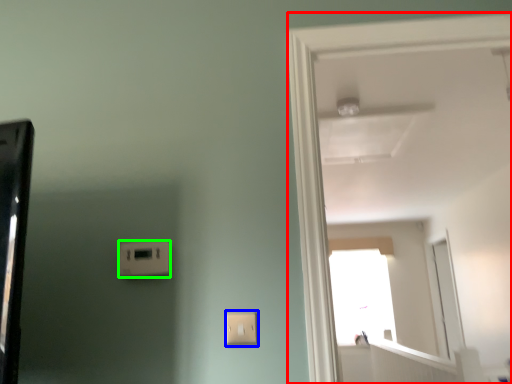
Question: Which object is the farthest from door (highlighted by a red box)? Choose among these: light switch (highlighted by a blue box) or light switch (highlighted by a green box).

Choices:
 (A) light switch
 (B) light switch

Answer: (B)